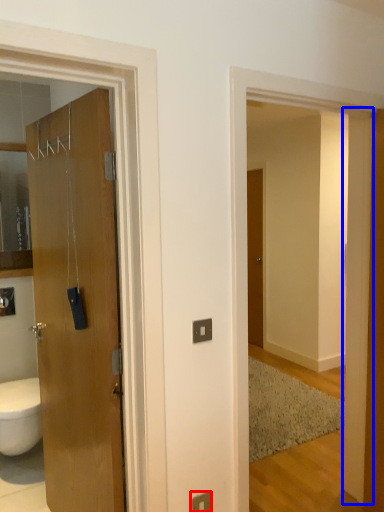
Question: Which point is closer to the camera, electric outlet (highlighted by a red box) or pillar (highlighted by a blue box)?

Choices:
 (A) electric outlet
 (B) pillar

Answer: (A)